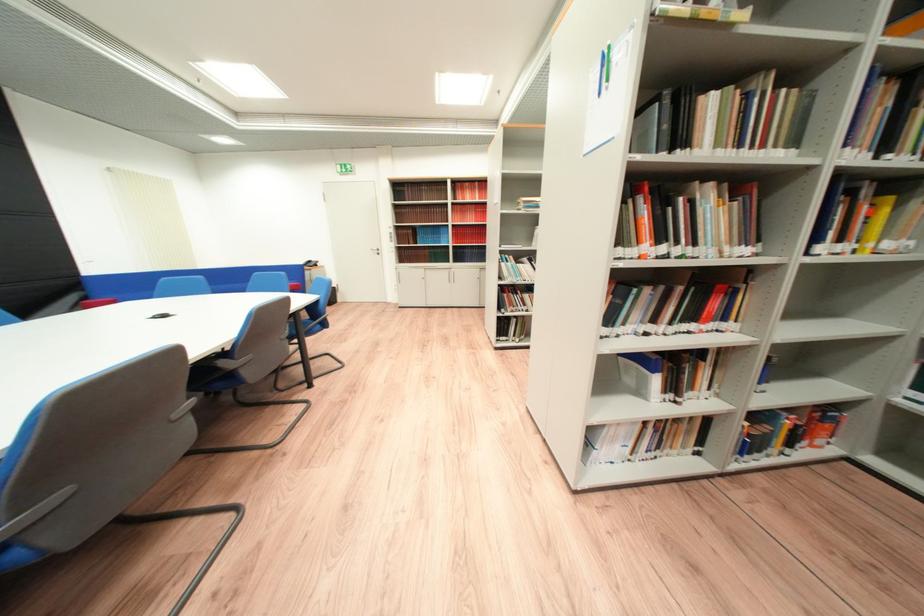
Find where to pull the cabinet door handle. Please return your answer as a coordinate pair (x, y).

(392, 256)